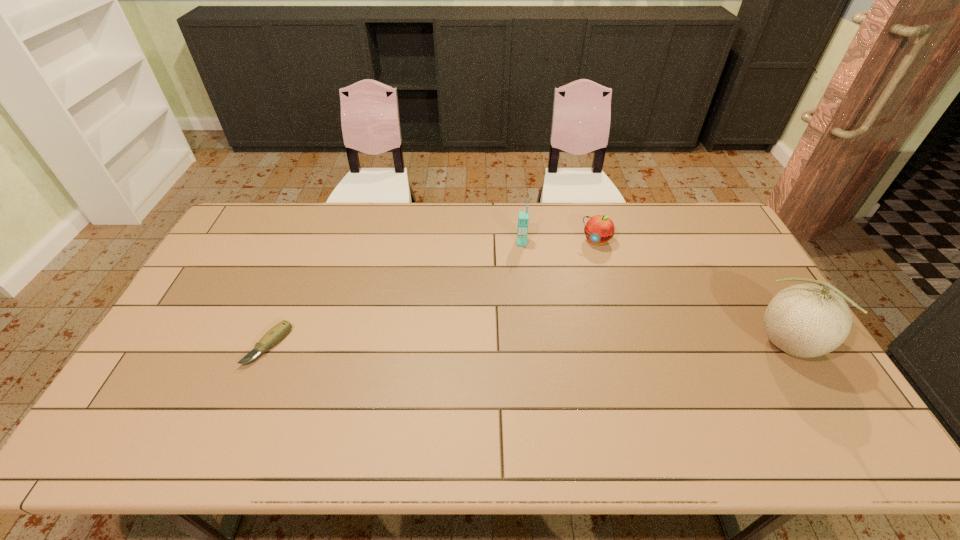
Find the location of a particular element. free space located on the keypad of the third object from right to left is located at coordinates (521, 323).

Where is `vacant region located on the keypad of the third object from right to left`? vacant region located on the keypad of the third object from right to left is located at coordinates (521, 289).

Image resolution: width=960 pixels, height=540 pixels. Identify the location of free region located 0.190m on the keypad of the third object from right to left. [x=521, y=286].

Where is `vacant area located on the surface of the third object from left to right`? vacant area located on the surface of the third object from left to right is located at coordinates [561, 298].

This screenshot has height=540, width=960. I want to click on free space located 0.260m on the surface of the third object from left to right, so click(x=561, y=298).

What are the coordinates of `free space located on the surface of the third object from left to right` in the screenshot? It's located at (575, 274).

The width and height of the screenshot is (960, 540). What are the coordinates of `cellular telephone that is at the far edge` in the screenshot? It's located at tap(523, 218).

At what (x,y) coordinates should I click in order to perform the action: click on apple that is positioned at the far edge. Please return your answer as a coordinate pair (x, y). This screenshot has height=540, width=960. Looking at the image, I should click on (599, 229).

Image resolution: width=960 pixels, height=540 pixels. In order to click on object at the right edge in this screenshot , I will do `click(806, 320)`.

Where is `vacant space at the far edge of the desktop`? Image resolution: width=960 pixels, height=540 pixels. vacant space at the far edge of the desktop is located at coordinates (309, 228).